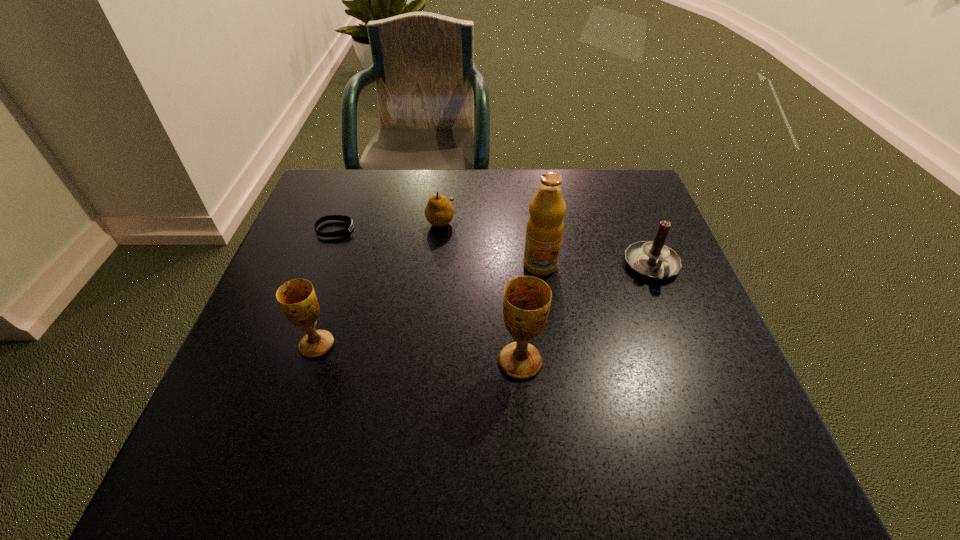
Locate an element on the screen. vacant space located on the back of the fourth shortest object is located at coordinates (359, 212).

Identify the location of vacant area located on the back of the fifth shortest object. (512, 251).

Where is `vacant space located 0.060m on the front label of the fruit juice`? Image resolution: width=960 pixels, height=540 pixels. vacant space located 0.060m on the front label of the fruit juice is located at coordinates (545, 297).

Identify the location of vacant area situated on the left of the pear. (332, 220).

Where is `free space located 0.230m on the side of the rightmost object with the handle loop`? free space located 0.230m on the side of the rightmost object with the handle loop is located at coordinates (698, 382).

This screenshot has height=540, width=960. Find the location of `free spot located 0.270m on the display of the shortest object`. free spot located 0.270m on the display of the shortest object is located at coordinates (463, 230).

Locate an element on the screen. This screenshot has height=540, width=960. object present at the far edge is located at coordinates (439, 212).

At what (x,y) coordinates should I click in order to perform the action: click on object that is at the near edge. Please return your answer as a coordinate pair (x, y). Image resolution: width=960 pixels, height=540 pixels. Looking at the image, I should click on (526, 303).

Where is `chalice at the left edge`? The height and width of the screenshot is (540, 960). chalice at the left edge is located at coordinates (297, 299).

What are the coordinates of `wristband at the left edge` in the screenshot? It's located at (346, 231).